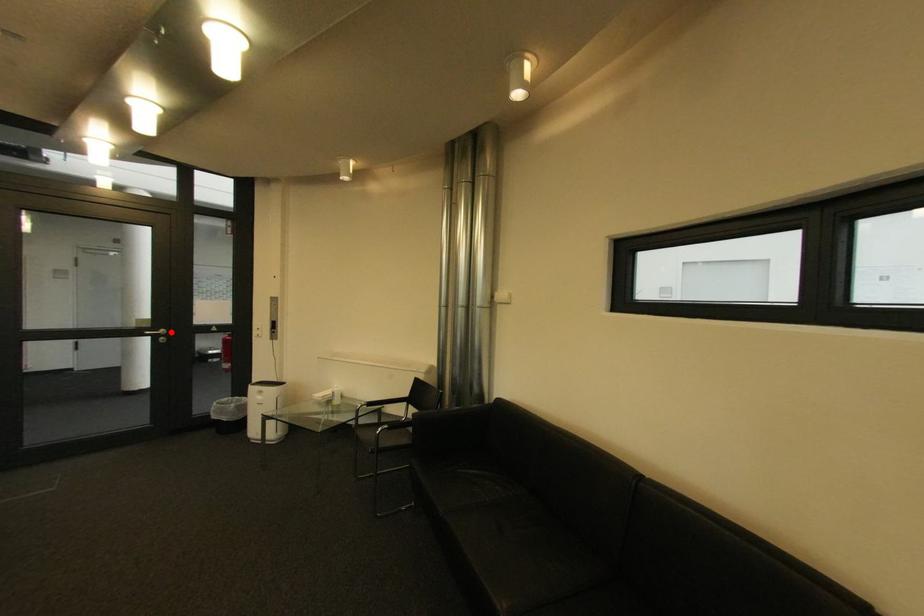
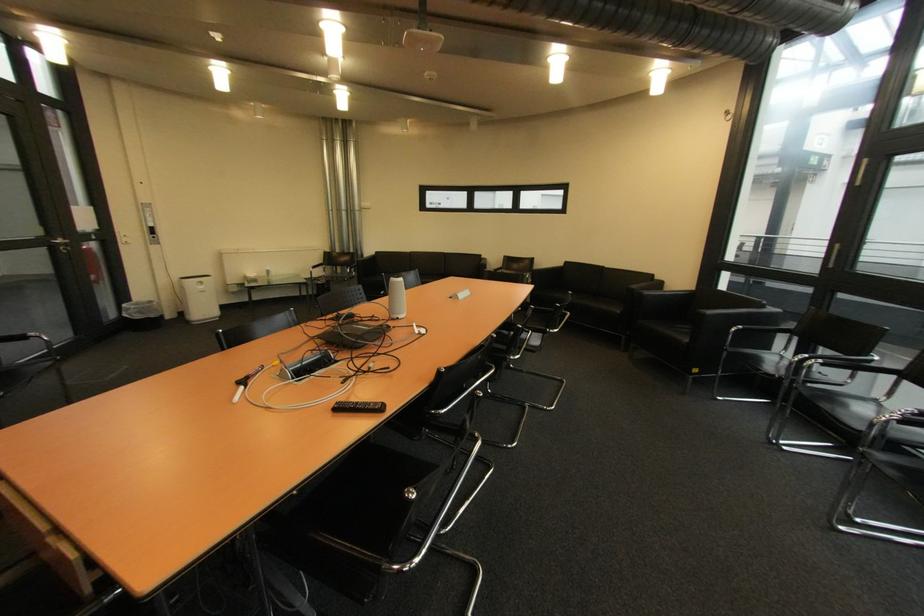
The point at the highlighted location is marked in the first image. Where is the corresponding point in the second image?

(68, 241)